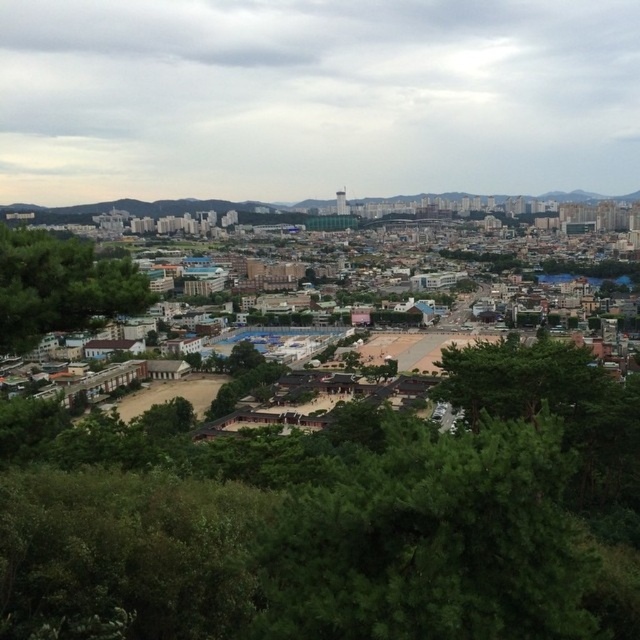
Question: Among these objects, which one is farthest from the camera?

Choices:
 (A) green leafy tree at center
 (B) green leafy tree at lower left

Answer: (B)

Question: Is green leafy tree at center bigger than green leafy tree at lower left?

Choices:
 (A) no
 (B) yes

Answer: (A)

Question: Which point appears closest to the camera in this image?

Choices:
 (A) (520, 406)
 (B) (97, 316)

Answer: (B)

Question: Can you confirm if green leafy tree at center is positioned to the right of green leafy tree at lower left?

Choices:
 (A) yes
 (B) no

Answer: (A)

Question: Is green leafy tree at center smaller than green leafy tree at lower left?

Choices:
 (A) yes
 (B) no

Answer: (A)